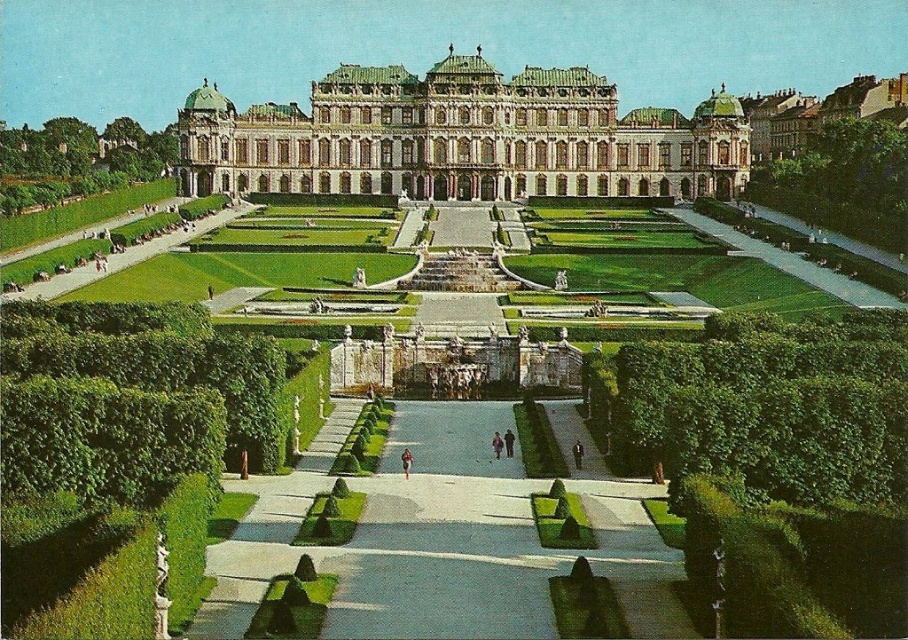
Question: Does green tiled roof at center appear on the left side of green leafy hedge at upper right?

Choices:
 (A) no
 (B) yes

Answer: (B)

Question: Which object is the farthest from the green leafy hedge at upper right?

Choices:
 (A) green tiled roof at center
 (B) green leafy hedge at lower left

Answer: (B)

Question: Does green leafy hedge at lower left have a greater width compared to green leafy hedge at upper right?

Choices:
 (A) no
 (B) yes

Answer: (B)

Question: Which point is farther to the camera?

Choices:
 (A) green leafy hedge at lower right
 (B) green leafy hedge at upper right

Answer: (B)

Question: Is green leafy hedge at lower left positioned before green leafy hedge at upper right?

Choices:
 (A) no
 (B) yes

Answer: (B)

Question: Estimate the real-world distances between objects in this image. Which object is farther from the green leafy hedge at lower left?

Choices:
 (A) green leafy hedge at upper right
 (B) green tiled roof at center

Answer: (A)